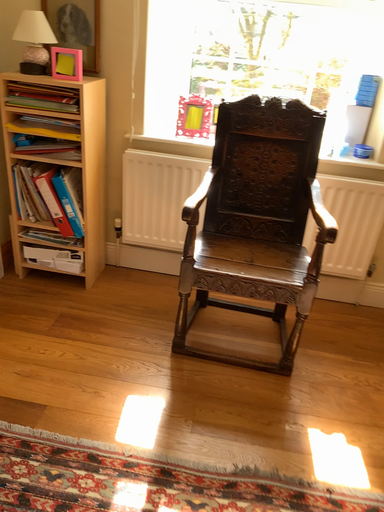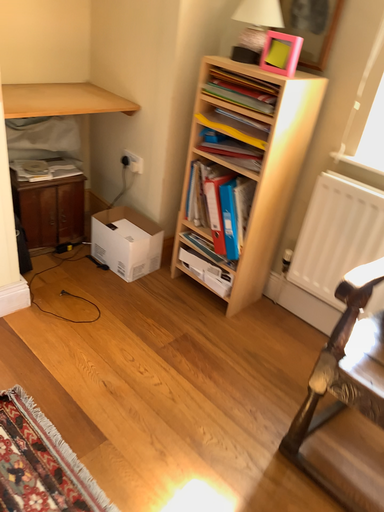
Question: Which way did the camera rotate in the video?

Choices:
 (A) rotated right
 (B) rotated left

Answer: (B)